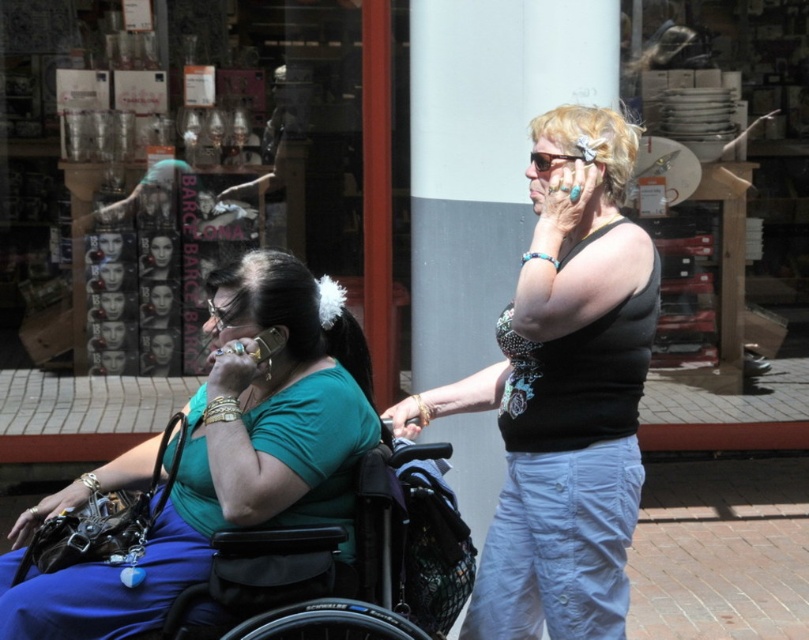
Between transparent glass display at center and black metallic wheelchair at center, which one is positioned lower?

Positioned lower is black metallic wheelchair at center.

Measure the distance between transparent glass display at center and camera.

transparent glass display at center is 5.40 meters away from camera.

I want to click on transparent glass display at center, so click(311, 129).

Based on the photo, is black dotted tank top at center bigger than green matte shirt at center?

Correct, black dotted tank top at center is larger in size than green matte shirt at center.

Is black dotted tank top at center smaller than green matte shirt at center?

No.

What do you see at coordinates (562, 392) in the screenshot?
I see `black dotted tank top at center` at bounding box center [562, 392].

The width and height of the screenshot is (809, 640). Find the location of `black dotted tank top at center`. black dotted tank top at center is located at coordinates (562, 392).

Image resolution: width=809 pixels, height=640 pixels. What do you see at coordinates (562, 392) in the screenshot?
I see `black dotted tank top at center` at bounding box center [562, 392].

Is point (572, 282) positioned behind point (332, 124)?

No.

Is point (541, 356) closer to camera compared to point (70, 364)?

Yes, point (541, 356) is in front of point (70, 364).

This screenshot has width=809, height=640. Find the location of `black dotted tank top at center`. black dotted tank top at center is located at coordinates (562, 392).